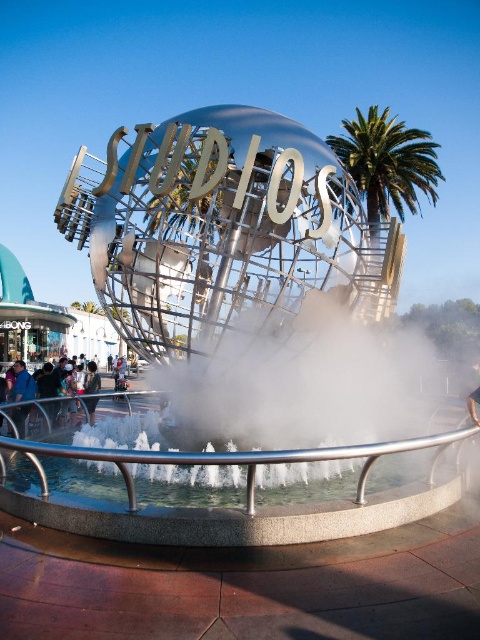
You are a photographer standing at the Universal Studios globe sculpture. You notice the metallic sphere at center and the blue fabric shirt at lower left in your viewfinder. Which object appears higher in the frame?

The metallic sphere at center is located above the blue fabric shirt at lower left, so it appears higher in the frame.

You are a photographer planning to capture the metallic sphere at center and the blue fabric shirt at lower left in a single shot. Considering their sizes, which object should you focus on first to ensure both are in frame without cropping?

The metallic sphere at center is larger than the blue fabric shirt at lower left. To ensure both are in frame without cropping, focus on positioning the larger metallic sphere at center first, then adjust the camera angle to include the smaller blue fabric shirt at lower left.

Consider the image. You are standing at the dark blue jeans at lower left and want to walk directly to the green leafy palm tree at upper right. Given that your walking speed is 3 feet per second, approximately how many seconds will it take you to reach the palm tree?

The distance between the green leafy palm tree at upper right and the dark blue jeans at lower left is 230.26 feet. At a walking speed of 3 feet per second, dividing 230.26 by 3 gives approximately 76.75 seconds. Rounding to the nearest whole number, it would take about 77 seconds to reach the palm tree.